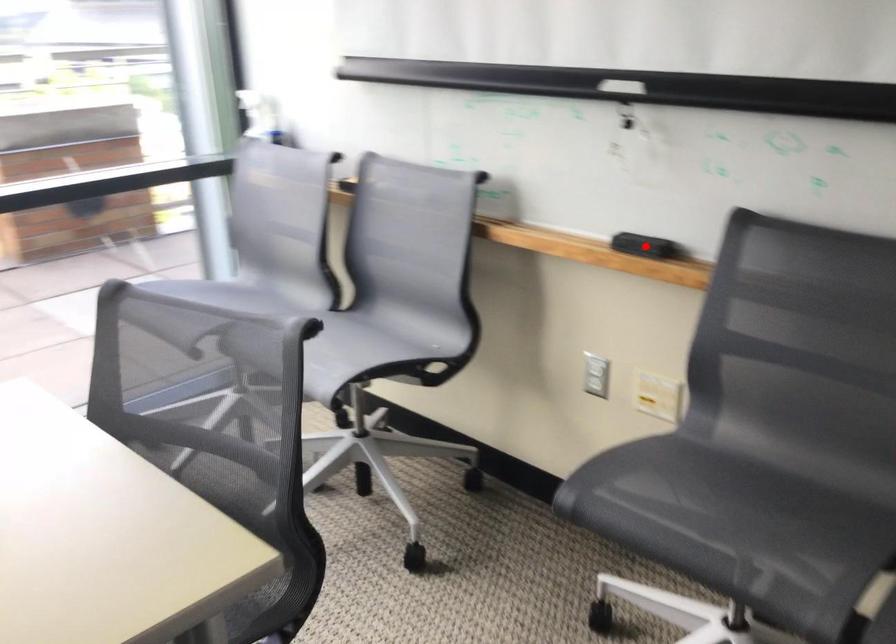
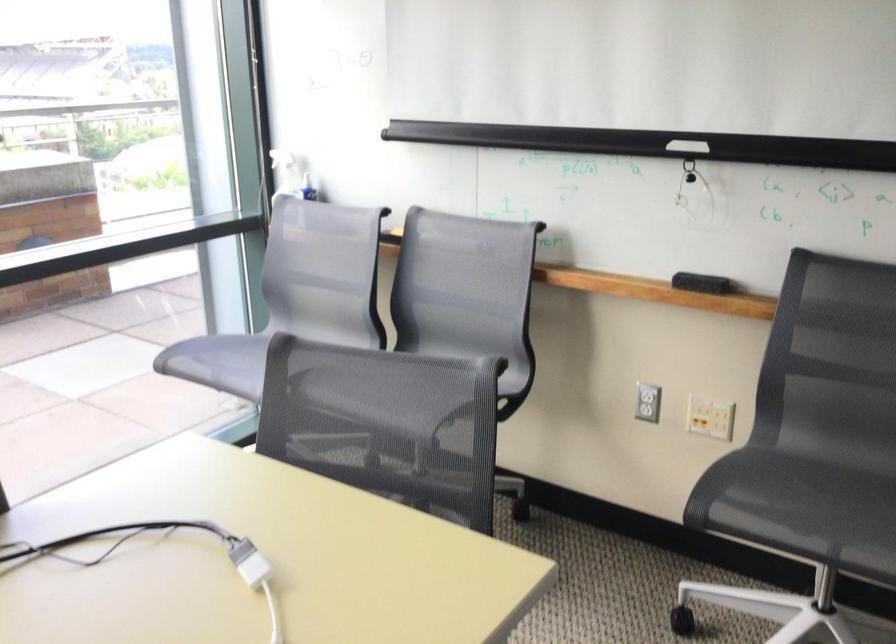
Question: I am providing you with two images of the same scene from different viewpoints. A red point is shown in image1. For the corresponding object point in image2, is it positioned nearer or farther from the camera?

Choices:
 (A) Nearer
 (B) Farther

Answer: (B)